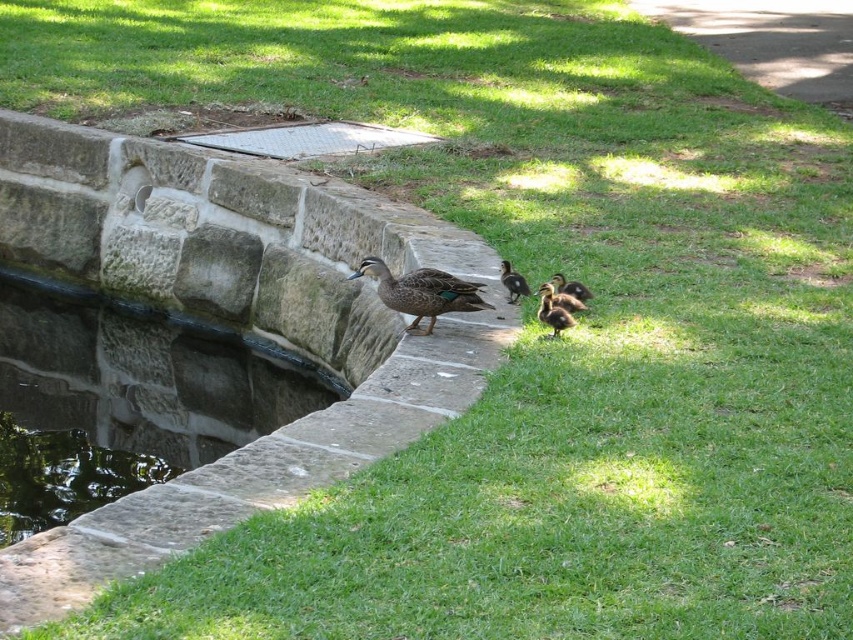
Who is shorter, clear stone water at lower left or brown speckled ducklings at center?

brown speckled ducklings at center is shorter.

Who is positioned more to the left, clear stone water at lower left or brown speckled ducklings at center?

From the viewer's perspective, clear stone water at lower left appears more on the left side.

The image size is (853, 640). Identify the location of clear stone water at lower left. (125, 397).

Find the location of a particular element. brown fuzzy duckling at lower center is located at coordinates (553, 310).

Where is `brown fuzzy duckling at lower center`? brown fuzzy duckling at lower center is located at coordinates (553, 310).

Is brown fuzzy duckling at lower center taller than green glossy duckling at center?

Yes.

The width and height of the screenshot is (853, 640). What do you see at coordinates (553, 310) in the screenshot?
I see `brown fuzzy duckling at lower center` at bounding box center [553, 310].

Is point (541, 308) closer to camera compared to point (579, 292)?

That is True.

At what (x,y) coordinates should I click in order to perform the action: click on brown fuzzy duckling at lower center. Please return your answer as a coordinate pair (x, y). The image size is (853, 640). Looking at the image, I should click on pos(553,310).